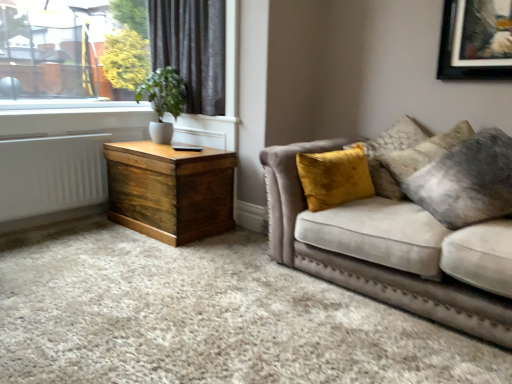
Question: Would you say dark grey velvet curtain at upper left is inside or outside wooden trunk at left?

Choices:
 (A) inside
 (B) outside

Answer: (B)

Question: Considering the positions of dark grey velvet curtain at upper left and wooden trunk at left in the image, is dark grey velvet curtain at upper left wider or thinner than wooden trunk at left?

Choices:
 (A) thin
 (B) wide

Answer: (A)

Question: Estimate the real-world distances between objects in this image. Which object is farther from the velvet beige couch at right?

Choices:
 (A) dark grey velvet curtain at upper left
 (B) velvet yellow pillow at right
 (C) green matte plant at upper left
 (D) wooden trunk at left
 (E) white painted radiator at left

Answer: (E)

Question: Which object is the closest to the velvet yellow pillow at right?

Choices:
 (A) velvet beige couch at right
 (B) green matte plant at upper left
 (C) white painted radiator at left
 (D) wooden trunk at left
 (E) dark grey velvet curtain at upper left

Answer: (A)